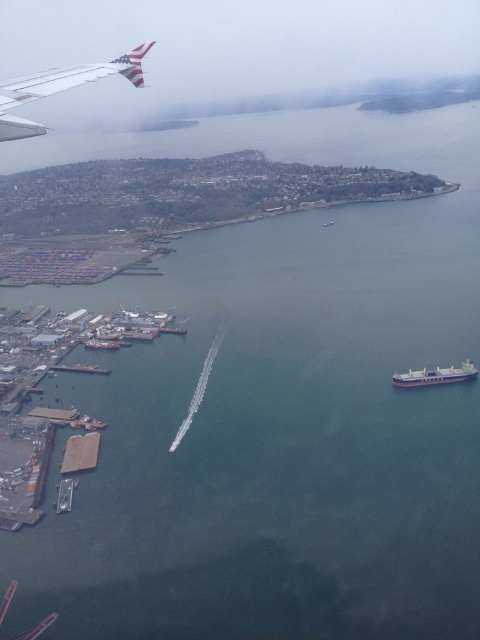
Question: From the image, what is the correct spatial relationship of white matte cargo ship at lower right in relation to smooth concrete dock at lower left?

Choices:
 (A) above
 (B) below

Answer: (A)

Question: Does smooth concrete dock at lower left appear on the left side of metallic silver boat at lower left?

Choices:
 (A) yes
 (B) no

Answer: (B)

Question: From the image, what is the correct spatial relationship of metallic silver boat at lower left in relation to metallic gray boat at lower left?

Choices:
 (A) above
 (B) below

Answer: (B)

Question: Based on their relative distances, which object is farther from the metallic silver wing at upper left?

Choices:
 (A) smooth concrete dock at lower left
 (B) white matte cargo ship at lower right

Answer: (B)

Question: Which object appears farthest from the camera in this image?

Choices:
 (A) smooth concrete dock at lower left
 (B) metallic silver boat at lower left
 (C) white matte cargo ship at lower right
 (D) metallic silver wing at upper left

Answer: (B)

Question: Which of the following is the closest to the observer?

Choices:
 (A) smooth concrete dock at lower left
 (B) metallic silver wing at upper left
 (C) metallic gray boat at lower left

Answer: (C)